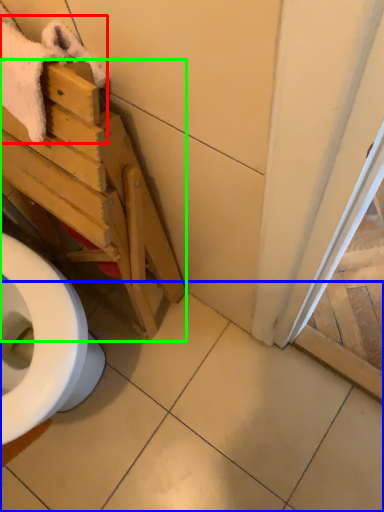
Question: Considering the real-world distances, which object is farthest from bath towel (highlighted by a red box)? tile (highlighted by a blue box) or furniture (highlighted by a green box)?

Choices:
 (A) tile
 (B) furniture

Answer: (A)